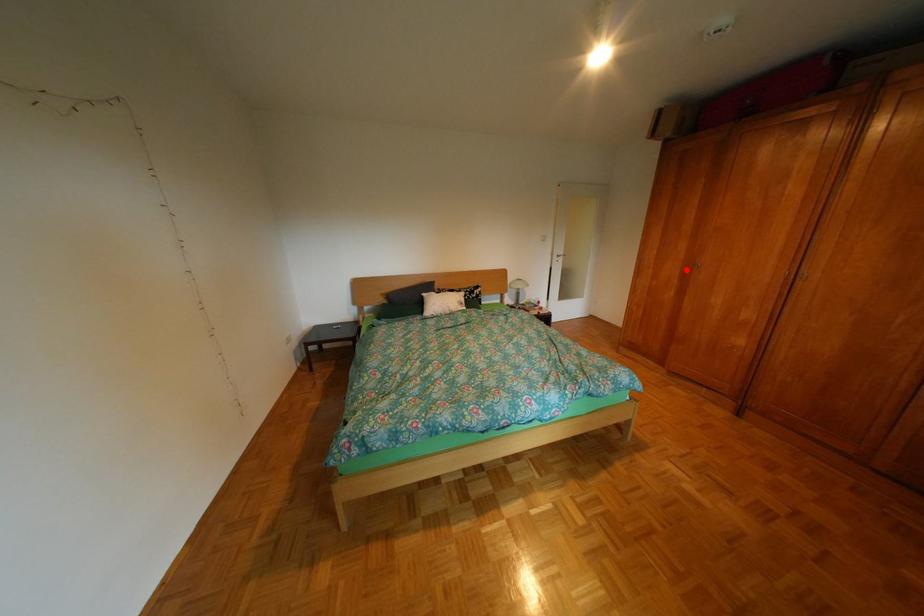
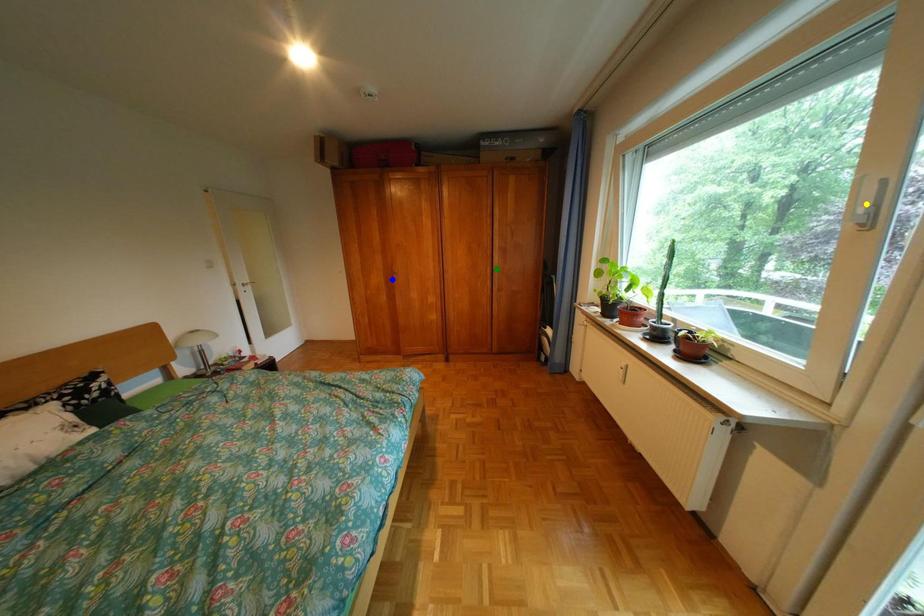
Question: I am providing you with two images of the same scene from different viewpoints. A red point is marked on the first image. You are given multiple points on the second image. Which spot in image 2 lines up with the point in image 1?

Choices:
 (A) blue point
 (B) yellow point
 (C) green point

Answer: (A)